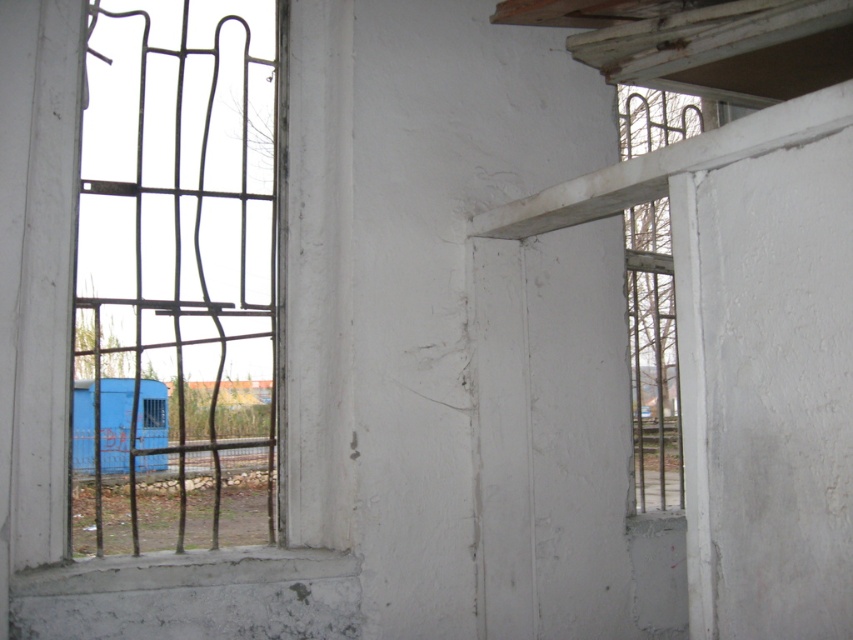
You are a security inspector checking the windows in this room. You notice the metallic wire mesh at left and the white concrete window sill at lower left. Which object is positioned more to the left side of the room?

The metallic wire mesh at left is positioned more to the left side of the room than the white concrete window sill at lower left because it is located to the left of it according to the description.

You are an interior designer assessing the room. You need to hang a large painting that requires a hook higher than the white concrete window sill at lower left. Can the metallic wire mesh at left provide a suitable mounting point?

The metallic wire mesh at left has a greater height compared to the white concrete window sill at lower left, so it can provide a suitable mounting point for the painting as it extends higher than the window sill.

You are an inspector checking the safety of the windows in this room. You notice the metallic wire mesh at left and the white concrete window sill at lower left. Which object is positioned higher relative to the other?

The metallic wire mesh at left is located above the white concrete window sill at lower left, so it is positioned higher.